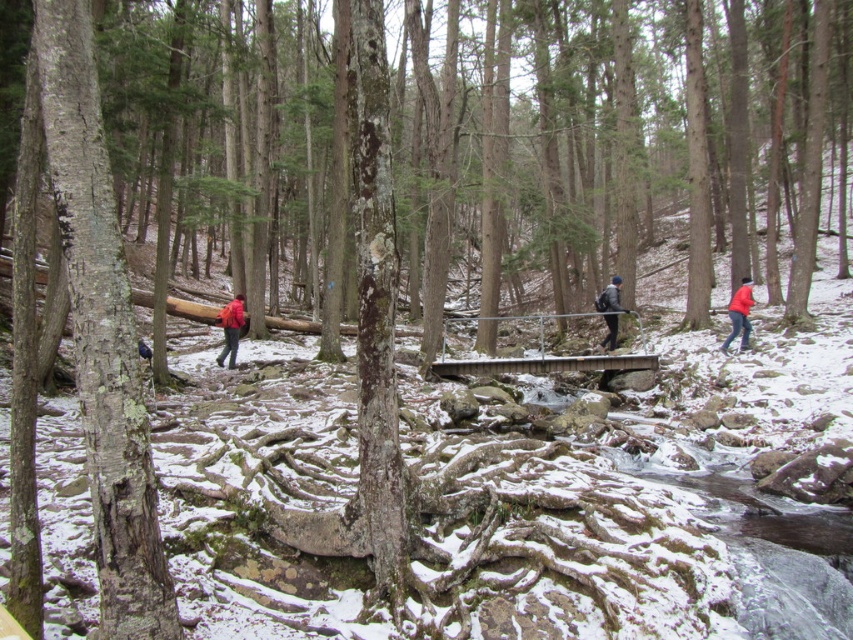
Between lichen-covered bark tree at left and dark gray backpack at center, which one is positioned lower?

lichen-covered bark tree at left is below.

Is lichen-covered bark tree at left taller than dark gray backpack at center?

Yes, lichen-covered bark tree at left is taller than dark gray backpack at center.

Between point (123, 621) and point (607, 340), which one is positioned behind?

The point (607, 340) is behind.

This screenshot has height=640, width=853. Find the location of `lichen-covered bark tree at left`. lichen-covered bark tree at left is located at coordinates (102, 332).

Who is positioned more to the left, lichen-covered bark tree at left or red fabric backpack at center-left?

From the viewer's perspective, red fabric backpack at center-left appears more on the left side.

Does lichen-covered bark tree at left appear on the right side of red fabric backpack at center-left?

Indeed, lichen-covered bark tree at left is positioned on the right side of red fabric backpack at center-left.

Between point (99, 176) and point (241, 320), which one is positioned behind?

Positioned behind is point (241, 320).

Find the location of `lichen-covered bark tree at left`. lichen-covered bark tree at left is located at coordinates (102, 332).

Identify the location of red matte jacket at right. (740, 314).

Image resolution: width=853 pixels, height=640 pixels. Find the location of `red matte jacket at right`. red matte jacket at right is located at coordinates (740, 314).